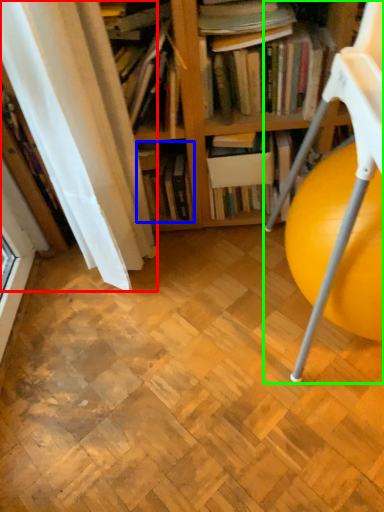
Question: Considering the real-world distances, which object is farthest from curtain (highlighted by a red box)? book (highlighted by a blue box) or rocking chair (highlighted by a green box)?

Choices:
 (A) book
 (B) rocking chair

Answer: (B)